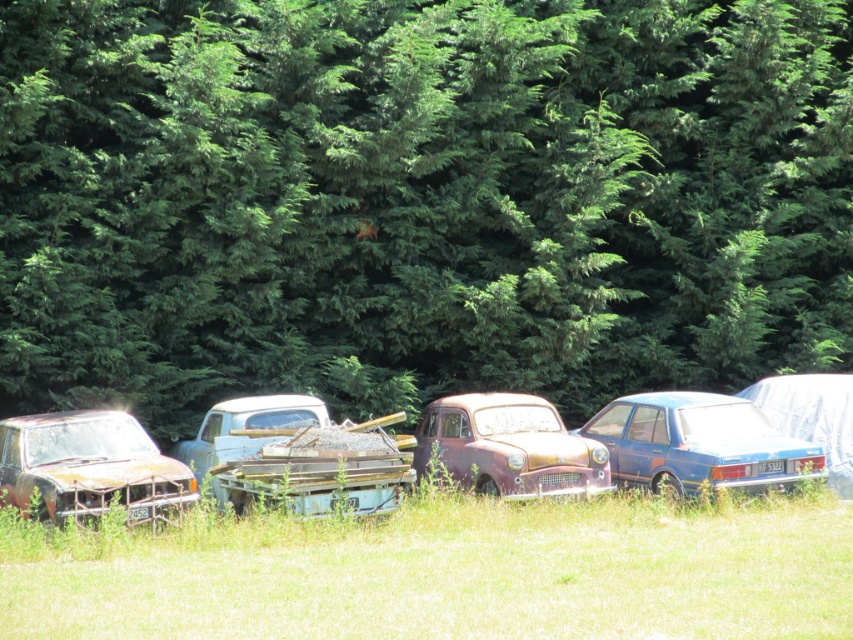
Is point (12, 468) less distant than point (189, 461)?

Yes.

Which of these two, rusty metal car at left or rusty metal truck at center, stands taller?

Standing taller between the two is rusty metal truck at center.

Which is in front, point (9, 493) or point (207, 410)?

Point (9, 493) is in front.

At what (x,y) coordinates should I click in order to perform the action: click on rusty metal car at left. Please return your answer as a coordinate pair (x, y). Image resolution: width=853 pixels, height=640 pixels. Looking at the image, I should click on (88, 467).

Who is higher up, green grass at lower center or rusty metal car at center?

rusty metal car at center is higher up.

Does green grass at lower center appear under rusty metal car at center?

Indeed, green grass at lower center is positioned under rusty metal car at center.

The width and height of the screenshot is (853, 640). I want to click on green grass at lower center, so click(x=445, y=572).

Locate an element on the screen. The image size is (853, 640). green grass at lower center is located at coordinates (445, 572).

Who is shorter, rusty metal car at left or rusty metal car at center?

rusty metal car at left

Who is more distant from viewer, (x=181, y=484) or (x=488, y=420)?

Point (x=488, y=420)

Between point (10, 472) and point (517, 492), which one is positioned in front?

Point (10, 472)

Where is `rusty metal car at left`? rusty metal car at left is located at coordinates pos(88,467).